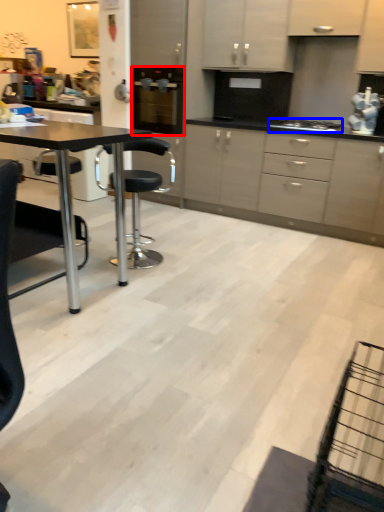
Question: Among these objects, which one is nearest to the camera, kitchen appliance (highlighted by a red box) or gas stove (highlighted by a blue box)?

Choices:
 (A) kitchen appliance
 (B) gas stove

Answer: (B)